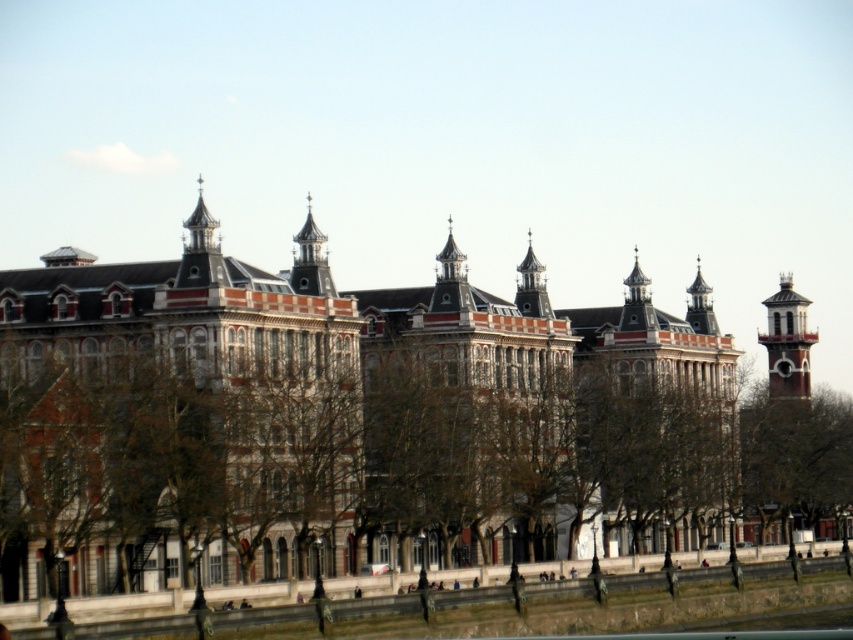
You are standing in front of the grand historic building and notice a brown leafless tree at center and a gray stone tower at center. Which object appears larger in the image?

The brown leafless tree at center appears larger than the gray stone tower at center in the image.

You are an architect analyzing the building. Which of the two towers, the gray stone tower at center or the polished brass clock tower at upper right, has a greater height?

The gray stone tower at center is taller than the polished brass clock tower at upper right.